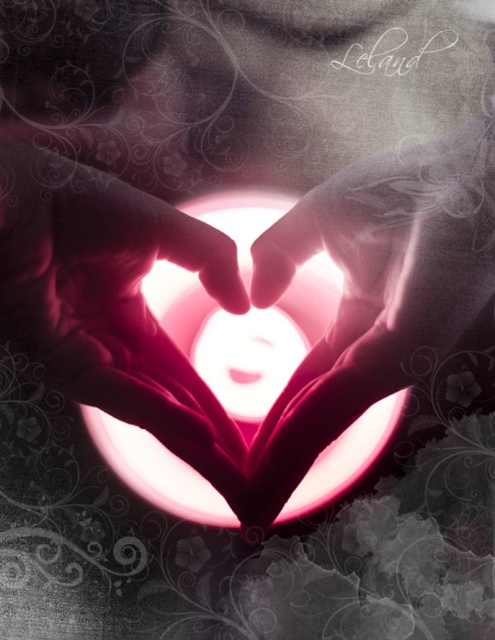
Does smooth skin hand at center have a larger size compared to translucent pink heart at center?

Actually, smooth skin hand at center might be smaller than translucent pink heart at center.

What do you see at coordinates (106, 291) in the screenshot? I see `smooth skin hand at center` at bounding box center [106, 291].

What are the coordinates of `smooth skin hand at center` in the screenshot? It's located at (106, 291).